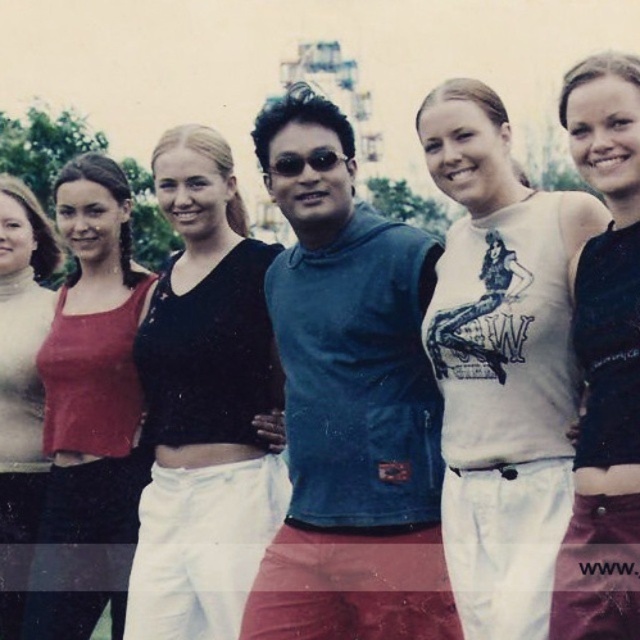
Question: Does blue fabric sleeveless shirt at center appear under black matte top at center?

Choices:
 (A) no
 (B) yes

Answer: (A)

Question: Which point is farther to the camera?

Choices:
 (A) (38, 404)
 (B) (461, 170)
 (C) (234, 298)
 (D) (579, 515)

Answer: (A)

Question: Which object is farther from the camera taking this photo?

Choices:
 (A) blue fabric sleeveless shirt at center
 (B) black matte top at center
 (C) black matte tank top at center
 (D) matte black tank top at left

Answer: (D)

Question: Which is nearer to the blue fabric sleeveless shirt at center?

Choices:
 (A) matte black tank top at left
 (B) white cotton tank top at center
 (C) matte red tank top at left
 (D) black matte top at center

Answer: (D)

Question: Is blue fabric sleeveless shirt at center below matte black tank top at left?

Choices:
 (A) no
 (B) yes

Answer: (A)

Question: Does white cotton tank top at center come behind matte black tank top at left?

Choices:
 (A) yes
 (B) no

Answer: (B)